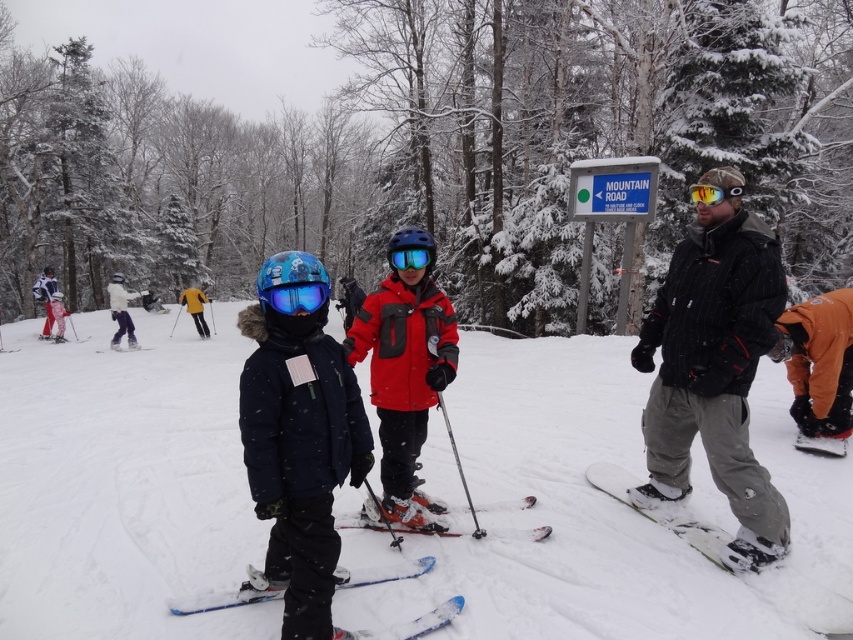
Question: Among these objects, which one is nearest to the camera?

Choices:
 (A) blue matte skis at center
 (B) white matte snowboard at lower right

Answer: (A)

Question: Can you confirm if white matte snowboarder at upper left is bigger than reflective yellow goggles at center?

Choices:
 (A) yes
 (B) no

Answer: (B)

Question: Which object appears closest to the camera in this image?

Choices:
 (A) reflective yellow goggles at center
 (B) matte blue ski jacket at center
 (C) white matte snowboarder at upper left

Answer: (B)

Question: Is tinted plastic goggles at center smaller than yellow fabric jacket at center?

Choices:
 (A) yes
 (B) no

Answer: (A)

Question: Which point is closer to the camera taking this photo?

Choices:
 (A) [120, 348]
 (B) [711, 266]
 (C) [189, 602]
 (D) [265, 580]

Answer: (D)

Question: Is white matte snowboard at lower right further to the viewer compared to yellow fabric jacket at center?

Choices:
 (A) yes
 (B) no

Answer: (B)